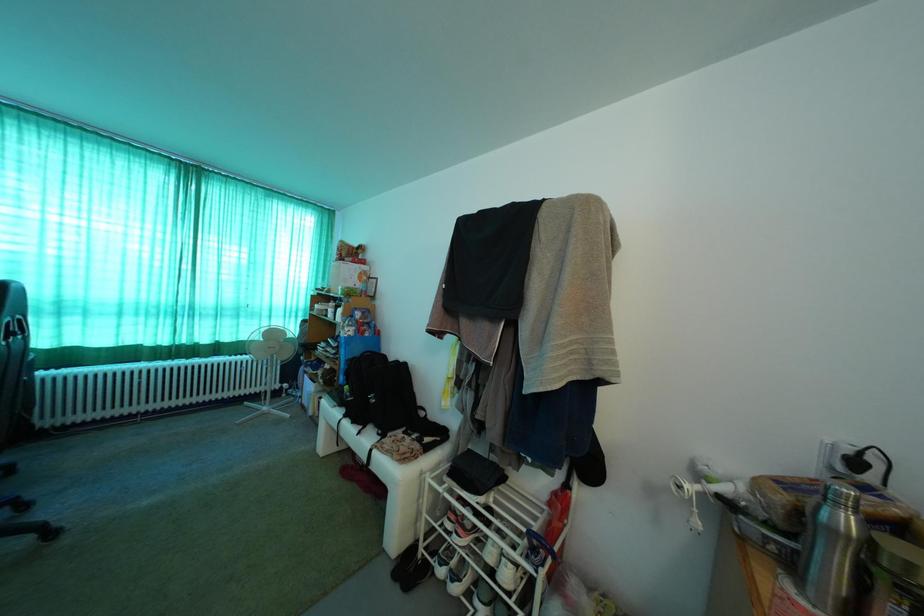
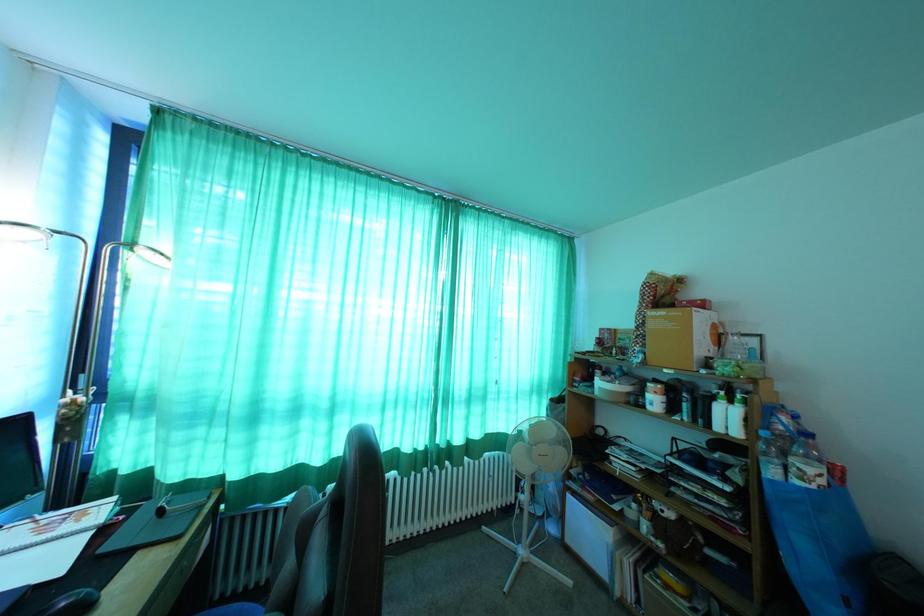
Which direction would the cameraman need to move to produce the second image?

The cameraman moved toward left, forward.